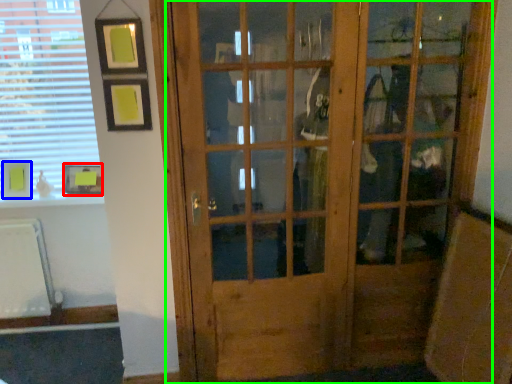
Question: Estimate the real-world distances between objects in this image. Which object is farther from picture frame (highlighted by a red box), picture frame (highlighted by a blue box) or door (highlighted by a green box)?

Choices:
 (A) picture frame
 (B) door

Answer: (B)